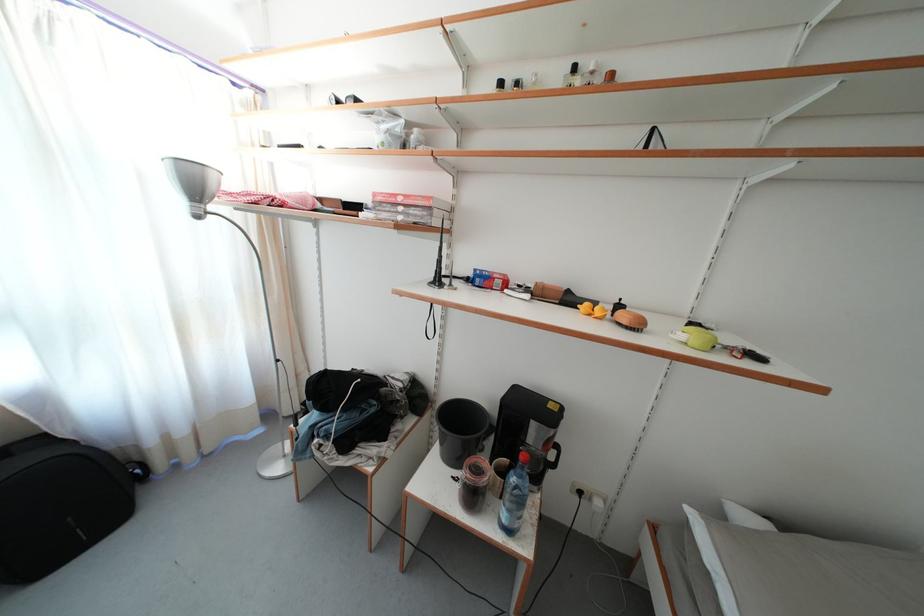
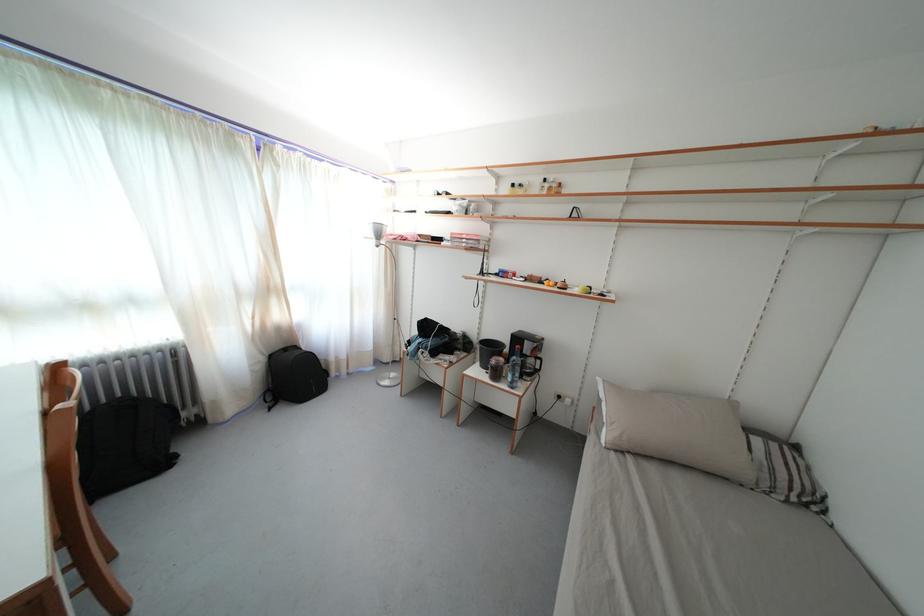
Find the pixel in the second image that matches pixel 506 90 in the first image.

(518, 191)